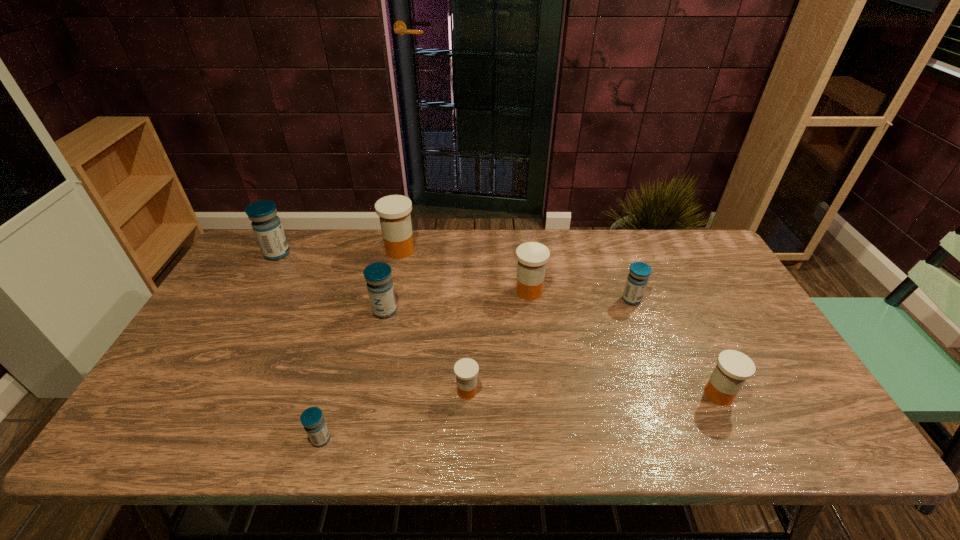
At what (x,y) coordinates should I click in order to perform the action: click on empty space that is in between the third smallest blue medicine and the fourth object from right to left. Please return your answer as a coordinate pair (x, y). The height and width of the screenshot is (540, 960). Looking at the image, I should click on (426, 351).

Locate an element on the screen. The height and width of the screenshot is (540, 960). free space between the rightmost orange medicine and the seventh medicine from left to right is located at coordinates (675, 347).

Where is `empty space that is in between the nearest medicine and the second blue medicine from right to left`? empty space that is in between the nearest medicine and the second blue medicine from right to left is located at coordinates (353, 375).

In order to click on the closest object to the second blue medicine from right to left in this screenshot , I will do `click(394, 211)`.

Choose which object is the sixth nearest neighbor to the second biggest blue medicine. Please provide its 2D coordinates. Your answer should be formatted as a tuple, i.e. [(x, y)], where the tuple contains the x and y coordinates of a point satisfying the conditions above.

[(639, 272)]

Find the location of `medicine that is the fifth closest one to the farthest blue medicine`. medicine that is the fifth closest one to the farthest blue medicine is located at coordinates (532, 257).

Identify which medicine is the seventh nearest to the third object from right to left. Please provide its 2D coordinates. Your answer should be formatted as a tuple, i.e. [(x, y)], where the tuple contains the x and y coordinates of a point satisfying the conditions above.

[(266, 225)]

Where is `the fourth closest blue medicine to the second orange medicine from right to left`? The height and width of the screenshot is (540, 960). the fourth closest blue medicine to the second orange medicine from right to left is located at coordinates (266, 225).

Identify which blue medicine is the second closest to the biggest orange medicine. Please provide its 2D coordinates. Your answer should be formatted as a tuple, i.e. [(x, y)], where the tuple contains the x and y coordinates of a point satisfying the conditions above.

[(266, 225)]

At what (x,y) coordinates should I click in order to perform the action: click on orange medicine that is the third closest to the third blue medicine from left to right. Please return your answer as a coordinate pair (x, y). Looking at the image, I should click on (532, 257).